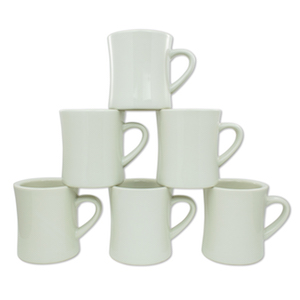
I want to click on mugs, so click(x=140, y=84), click(x=200, y=153), click(x=112, y=149), click(x=51, y=206), click(x=161, y=208), click(x=222, y=200).